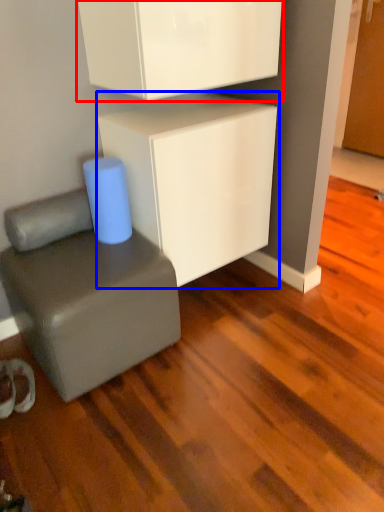
Question: Which point is closer to the camera, cabinetry (highlighted by a red box) or cabinetry (highlighted by a blue box)?

Choices:
 (A) cabinetry
 (B) cabinetry

Answer: (A)